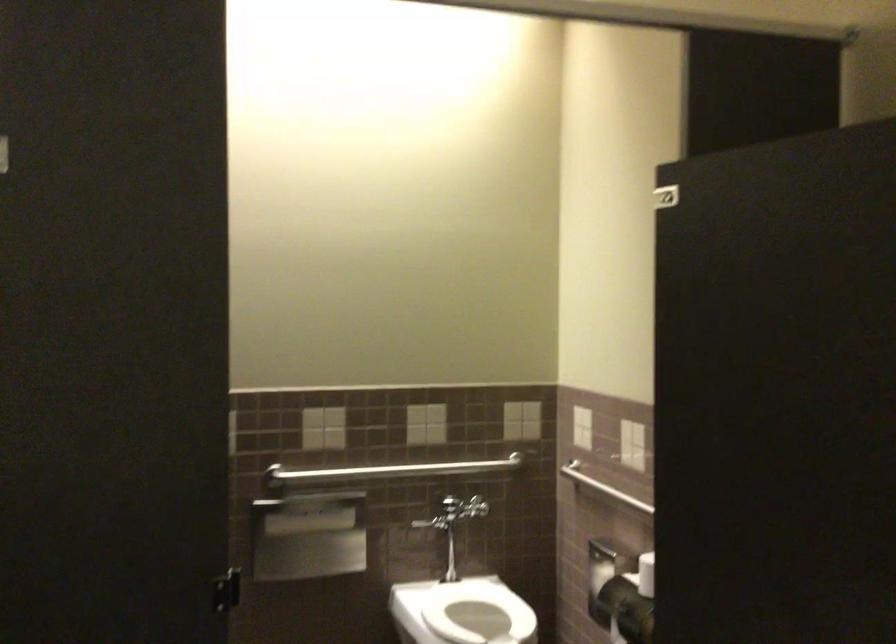
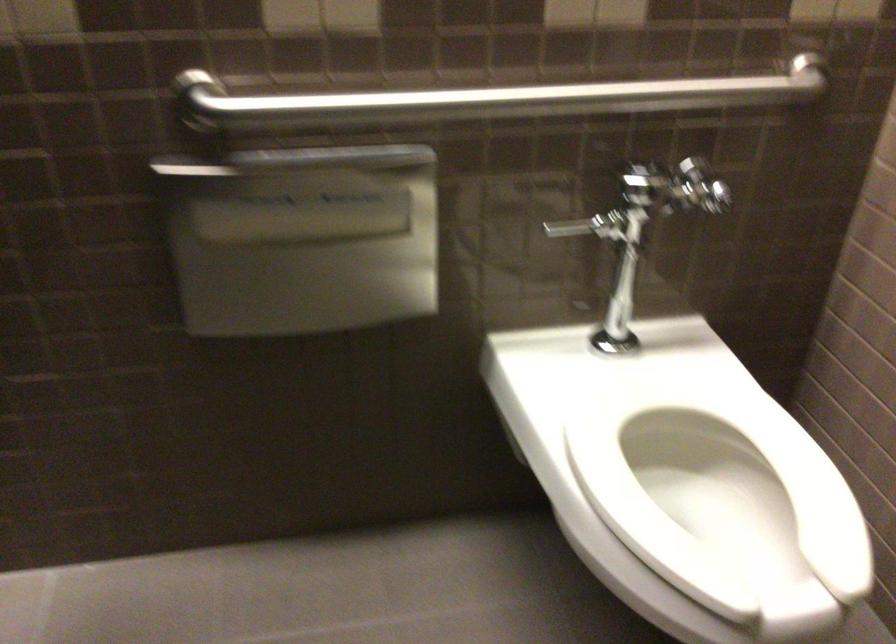
In the second image, find the point that corresponds to (383,466) in the first image.

(488, 100)